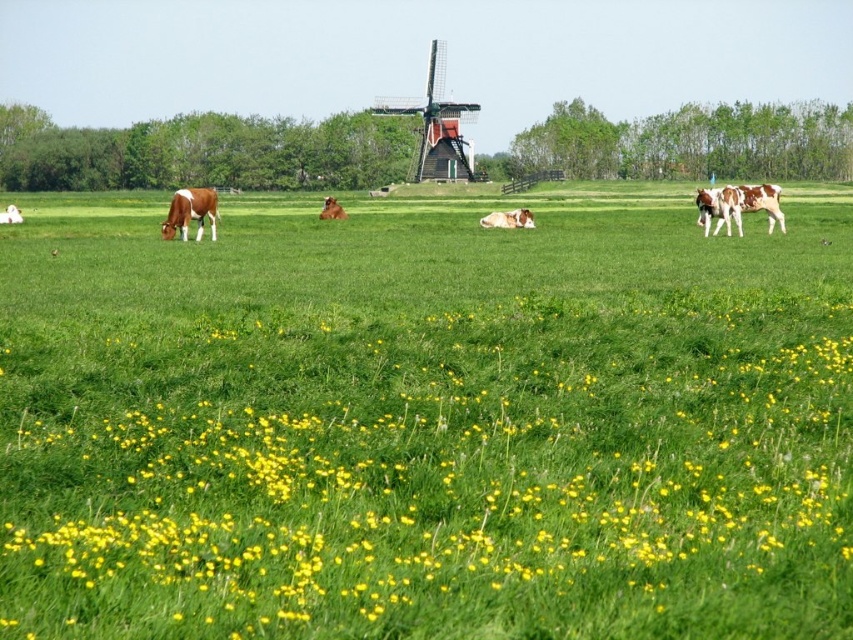
Can you confirm if brown glossy cow at left is shorter than brown furry cow at center?

No, brown glossy cow at left is not shorter than brown furry cow at center.

Does brown glossy cow at left appear over brown furry cow at center?

Yes, brown glossy cow at left is above brown furry cow at center.

Find the location of a particular element. brown glossy cow at left is located at coordinates (190, 212).

Is brown glossy cow at left taller than brown glossy cow at upper left?

Yes, brown glossy cow at left is taller than brown glossy cow at upper left.

Does point (175, 198) come behind point (7, 208)?

No, it is in front of (7, 208).

Locate an element on the screen. The width and height of the screenshot is (853, 640). brown glossy cow at left is located at coordinates (190, 212).

Is brown and white spotted cow at right below brown glossy cow at left?

Yes.

Locate an element on the screen. The width and height of the screenshot is (853, 640). brown and white spotted cow at right is located at coordinates 738,205.

Does point (722, 221) lie in front of point (173, 211)?

No, it is not.

Locate an element on the screen. Image resolution: width=853 pixels, height=640 pixels. brown and white spotted cow at right is located at coordinates (738, 205).